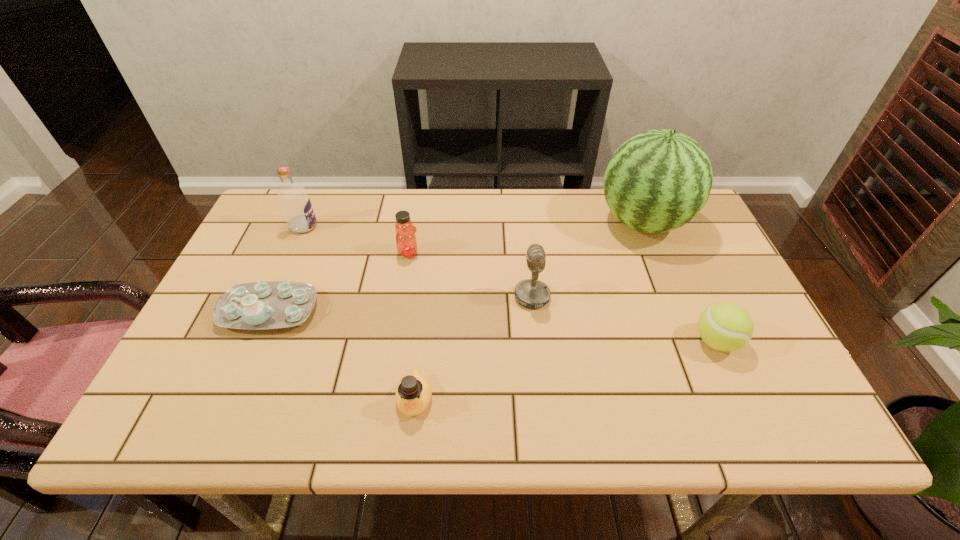
Identify the location of watermelon. The width and height of the screenshot is (960, 540). (657, 181).

Image resolution: width=960 pixels, height=540 pixels. In order to click on vodka in this screenshot , I will do `click(295, 203)`.

Image resolution: width=960 pixels, height=540 pixels. Find the location of `microphone`. microphone is located at coordinates (531, 293).

Image resolution: width=960 pixels, height=540 pixels. I want to click on the third tallest object, so click(531, 293).

Locate an element on the screen. the fourth tallest object is located at coordinates (406, 242).

Find the location of a particular element. tennis ball is located at coordinates (724, 326).

The image size is (960, 540). Identify the location of chinaware. (258, 305).

Where is `duck`? duck is located at coordinates [413, 394].

Identify the location of free space located on the left of the tallest object. (560, 222).

Identify the location of free region located on the label of the vodka. (367, 226).